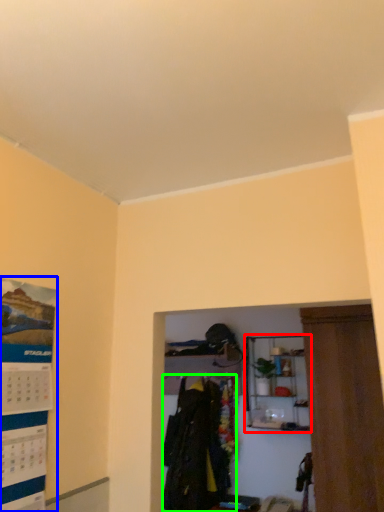
Question: Which is nearer to the shelf (highlighted by a red box)? poster page (highlighted by a blue box) or clothing (highlighted by a green box).

Choices:
 (A) poster page
 (B) clothing

Answer: (B)